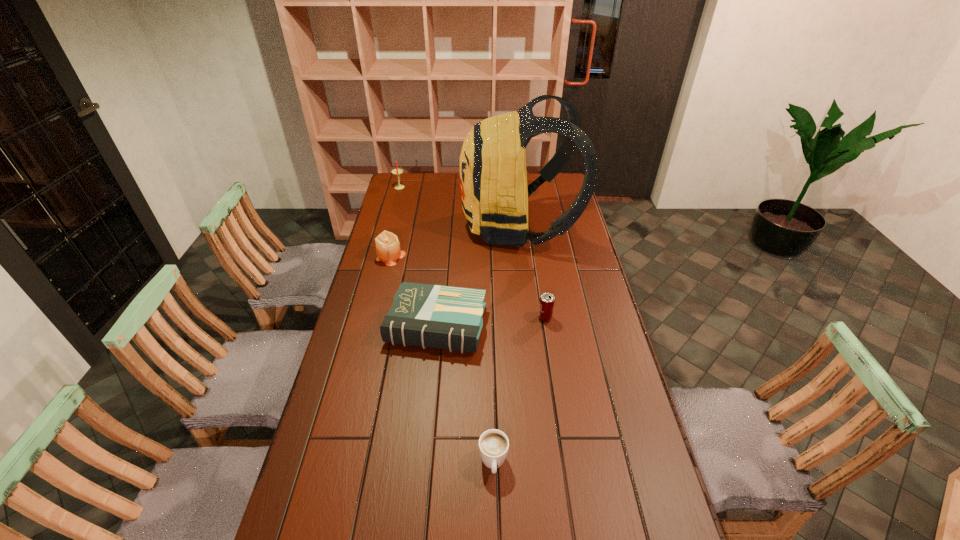
The image size is (960, 540). I want to click on the tallest object, so click(x=493, y=177).

This screenshot has height=540, width=960. In order to click on the farthest object in this screenshot , I will do `click(396, 171)`.

Locate an element on the screen. The width and height of the screenshot is (960, 540). the nearer candle is located at coordinates (388, 250).

The width and height of the screenshot is (960, 540). Identify the location of beer can. (546, 305).

What are the coordinates of `paperback book` in the screenshot? It's located at (444, 317).

The image size is (960, 540). I want to click on the shortest object, so click(493, 444).

Where is `cappuccino`? cappuccino is located at coordinates (493, 444).

Image resolution: width=960 pixels, height=540 pixels. Identify the location of vacant region located 0.270m on the front-facing side of the tallest object. (402, 226).

Where is `vacant space located 0.120m on the front-facing side of the tallest object`? This screenshot has width=960, height=540. vacant space located 0.120m on the front-facing side of the tallest object is located at coordinates (435, 226).

Find the location of a particular element. The width and height of the screenshot is (960, 540). free location located on the front-facing side of the tallest object is located at coordinates (407, 226).